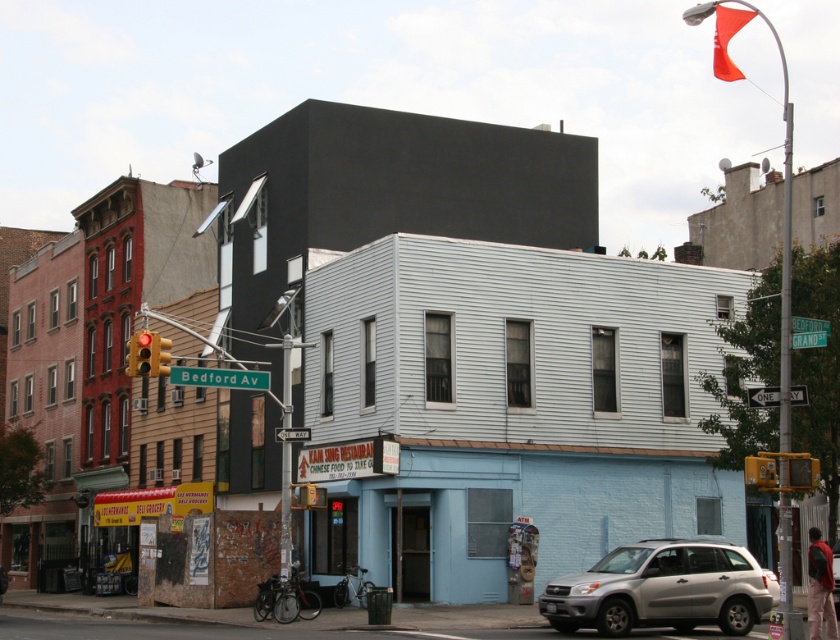
Question: Does silver metallic suv at lower right have a larger size compared to red glass traffic light at upper left?

Choices:
 (A) no
 (B) yes

Answer: (A)

Question: Is silver metallic suv at lower right positioned behind red glass traffic light at upper left?

Choices:
 (A) yes
 (B) no

Answer: (B)

Question: Which point is farther from the camera taking this photo?

Choices:
 (A) (762, 596)
 (B) (147, 360)

Answer: (B)

Question: Which object is the closest to the red glass traffic light at upper left?

Choices:
 (A) silver metallic suv at lower right
 (B) greenmaterial/texturestreet sign at upper center
 (C) yellow metallic traffic light at left
 (D) red glass traffic light at left

Answer: (D)

Question: Is red glass traffic light at left closer to the viewer compared to red glass traffic light at upper left?

Choices:
 (A) yes
 (B) no

Answer: (A)

Question: Which object appears farthest from the camera in this image?

Choices:
 (A) red glass traffic light at left
 (B) greenmaterial/texturestreet sign at upper center

Answer: (B)